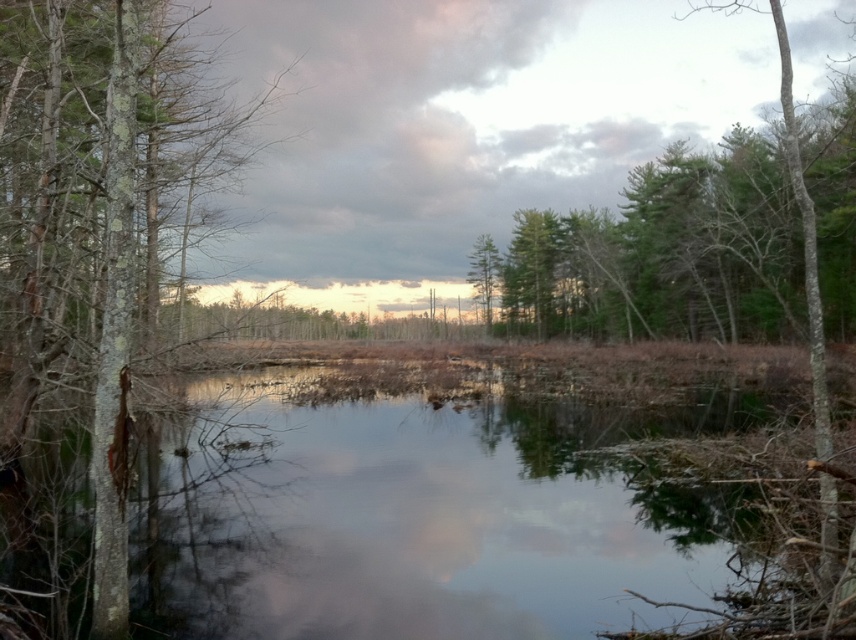
Question: Does green textured tree at upper center appear on the left side of green leafy tree at center?

Choices:
 (A) no
 (B) yes

Answer: (A)

Question: Which point is farther from the camera taking this photo?

Choices:
 (A) [621, 284]
 (B) [111, 618]

Answer: (A)

Question: Which object appears farthest from the camera in this image?

Choices:
 (A) smooth bark tree at left
 (B) green leafy tree at center

Answer: (B)

Question: Can you confirm if smooth bark tree at left is thinner than green textured tree at upper center?

Choices:
 (A) yes
 (B) no

Answer: (A)

Question: Does smooth bark tree at left have a larger size compared to green leafy tree at center?

Choices:
 (A) yes
 (B) no

Answer: (A)

Question: Among these points, which one is farthest from the camera?

Choices:
 (A) (x=116, y=512)
 (B) (x=471, y=253)
 (C) (x=572, y=253)

Answer: (B)